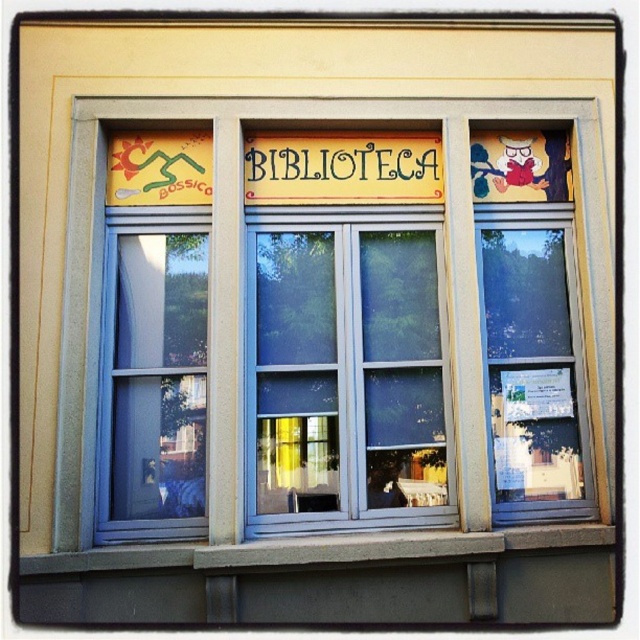
Question: Is clear glass window at center further to camera compared to blue glass window at left?

Choices:
 (A) yes
 (B) no

Answer: (A)

Question: Which of the following is the farthest from the observer?

Choices:
 (A) (301, 152)
 (B) (205, 243)
 (C) (285, 464)

Answer: (A)

Question: In this image, where is blue glass window at left located relative to yellow painted wood sign at center?

Choices:
 (A) above
 (B) below

Answer: (B)

Question: Does clear glass window at center have a greater width compared to blue glass window at left?

Choices:
 (A) yes
 (B) no

Answer: (A)

Question: Which point appears farthest from the camera in this image?

Choices:
 (A) (166, 397)
 (B) (260, 134)

Answer: (B)

Question: Which object appears closest to the camera in this image?

Choices:
 (A) blue glass window at left
 (B) yellow painted wood sign at center
 (C) clear glass window at center

Answer: (A)